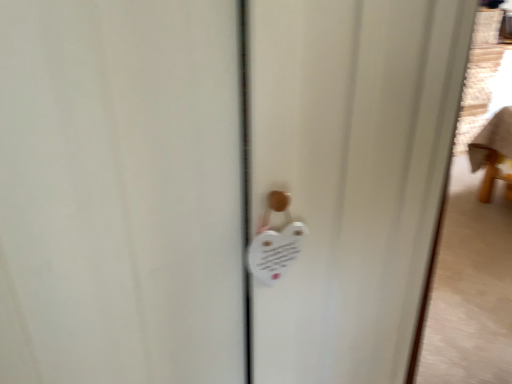
Describe the element at coordinates (351, 174) in the screenshot. I see `white matte heart-shaped magnet at center` at that location.

Where is `white matte heart-shaped magnet at center`? white matte heart-shaped magnet at center is located at coordinates (351, 174).

I want to click on white plastic lock at center, so click(x=275, y=242).

This screenshot has height=384, width=512. Describe the element at coordinates (275, 242) in the screenshot. I see `white plastic lock at center` at that location.

Find the location of a particular element. This screenshot has height=384, width=512. white matte heart-shaped magnet at center is located at coordinates (351, 174).

Is white plastic lock at center to the left or to the right of white matte heart-shaped magnet at center in the image?

From the image, it's evident that white plastic lock at center is to the left of white matte heart-shaped magnet at center.

Which object is further away from the camera taking this photo, white plastic lock at center or white matte heart-shaped magnet at center?

white matte heart-shaped magnet at center is further away from the camera.

Is point (267, 237) positioned in front of point (421, 206)?

Yes, point (267, 237) is in front of point (421, 206).

From the image's perspective, who appears lower, white plastic lock at center or white matte heart-shaped magnet at center?

white matte heart-shaped magnet at center appears lower in the image.

From a real-world perspective, relative to white matte heart-shaped magnet at center, is white plastic lock at center vertically above or below?

In terms of real-world spatial position, white plastic lock at center is above white matte heart-shaped magnet at center.

Looking at their sizes, would you say white plastic lock at center is wider or thinner than white matte heart-shaped magnet at center?

white plastic lock at center is thinner than white matte heart-shaped magnet at center.

Which of these two, white plastic lock at center or white matte heart-shaped magnet at center, stands taller?

With more height is white plastic lock at center.

Who is smaller, white plastic lock at center or white matte heart-shaped magnet at center?

Smaller between the two is white plastic lock at center.

Is white plastic lock at center not within white matte heart-shaped magnet at center?

Yes, white plastic lock at center is located beyond the bounds of white matte heart-shaped magnet at center.

Would you consider white plastic lock at center to be distant from white matte heart-shaped magnet at center?

No, white plastic lock at center is not far away from white matte heart-shaped magnet at center.

Is white plastic lock at center facing towards white matte heart-shaped magnet at center?

No, white plastic lock at center does not turn towards white matte heart-shaped magnet at center.

Measure the distance between white plastic lock at center and white matte heart-shaped magnet at center.

white plastic lock at center is 9.87 inches from white matte heart-shaped magnet at center.

Identify the location of screen door directly beneath the white plastic lock at center (from a real-world perspective). The height and width of the screenshot is (384, 512). (351, 174).

Which is more to the right, white matte heart-shaped magnet at center or white plastic lock at center?

white matte heart-shaped magnet at center.

Is white matte heart-shaped magnet at center further to camera compared to white plastic lock at center?

That is True.

Which point is more distant from viewer, (x=276, y=115) or (x=278, y=257)?

Positioned behind is point (x=278, y=257).

From the image's perspective, is white matte heart-shaped magnet at center on top of white plastic lock at center?

Actually, white matte heart-shaped magnet at center appears below white plastic lock at center in the image.

From a real-world perspective, is white matte heart-shaped magnet at center physically located above or below white plastic lock at center?

In terms of real-world spatial position, white matte heart-shaped magnet at center is below white plastic lock at center.

From the picture: Considering the sizes of white matte heart-shaped magnet at center and white plastic lock at center in the image, is white matte heart-shaped magnet at center wider or thinner than white plastic lock at center?

In the image, white matte heart-shaped magnet at center appears to be wider than white plastic lock at center.

Can you confirm if white matte heart-shaped magnet at center is taller than white plastic lock at center?

Incorrect, the height of white matte heart-shaped magnet at center is not larger of that of white plastic lock at center.

Who is bigger, white matte heart-shaped magnet at center or white plastic lock at center?

white matte heart-shaped magnet at center is bigger.

Would you say white plastic lock at center is part of white matte heart-shaped magnet at center's contents?

Actually, white plastic lock at center is outside white matte heart-shaped magnet at center.

Is there a large distance between white matte heart-shaped magnet at center and white plastic lock at center?

They are positioned close to each other.

Is white matte heart-shaped magnet at center oriented away from white plastic lock at center?

No, white matte heart-shaped magnet at center is not facing away from white plastic lock at center.

Locate an element on the screen. The width and height of the screenshot is (512, 384). lock in front of the white matte heart-shaped magnet at center is located at coordinates (275, 242).

The width and height of the screenshot is (512, 384). What are the coordinates of `screen door lying behind the white plastic lock at center` in the screenshot? It's located at pos(351,174).

The height and width of the screenshot is (384, 512). What are the coordinates of `lock positioned vertically above the white matte heart-shaped magnet at center (from a real-world perspective)` in the screenshot? It's located at (275, 242).